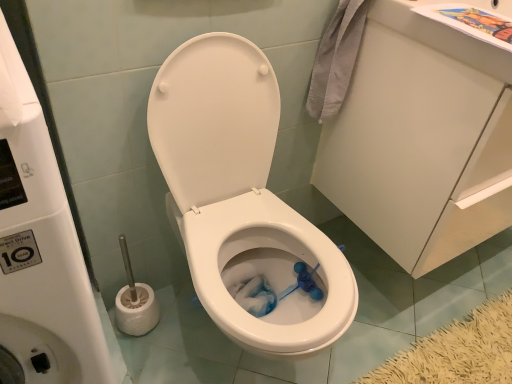
Question: From a real-world perspective, is white glossy toilet at center physically located above or below white glossy water tank at upper center?

Choices:
 (A) below
 (B) above

Answer: (A)

Question: From the image's perspective, is white glossy toilet at center located above or below white glossy water tank at upper center?

Choices:
 (A) below
 (B) above

Answer: (B)

Question: Based on their relative distances, which object is farther from the white glossy cabinet at upper right?

Choices:
 (A) white glossy toilet at center
 (B) white glossy water tank at upper center

Answer: (B)

Question: Which is nearer to the white glossy cabinet at upper right?

Choices:
 (A) white glossy water tank at upper center
 (B) white glossy toilet at center

Answer: (B)